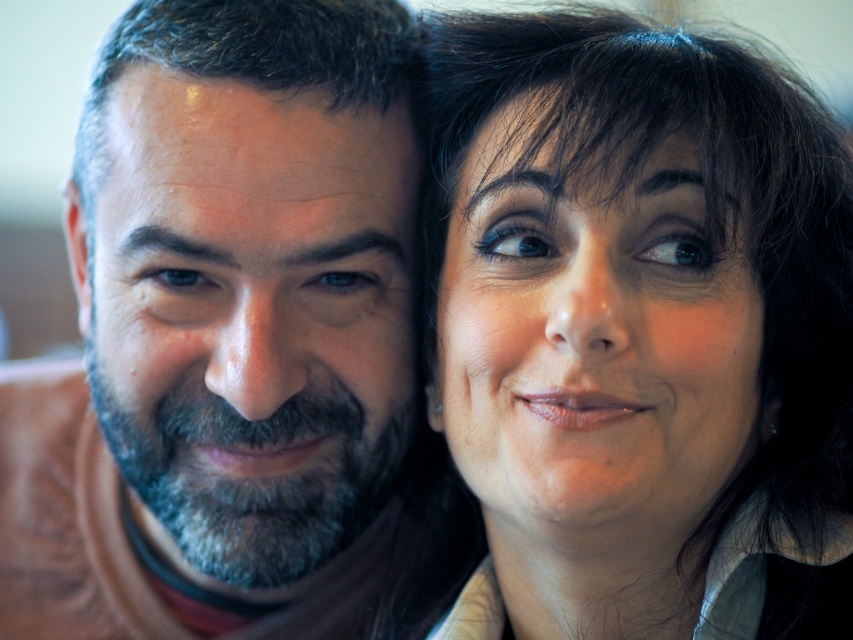
Question: Which point is farther to the camera?

Choices:
 (A) (170, 476)
 (B) (764, 136)

Answer: (A)

Question: Can you confirm if smooth black hair at upper right is positioned above brown matte shirt at left?

Choices:
 (A) yes
 (B) no

Answer: (A)

Question: Which point is closer to the camera?

Choices:
 (A) brown matte shirt at left
 (B) smooth black hair at upper right

Answer: (B)

Question: Does smooth black hair at upper right have a greater width compared to brown matte shirt at left?

Choices:
 (A) no
 (B) yes

Answer: (A)

Question: Does smooth black hair at upper right have a larger size compared to brown matte shirt at left?

Choices:
 (A) no
 (B) yes

Answer: (A)